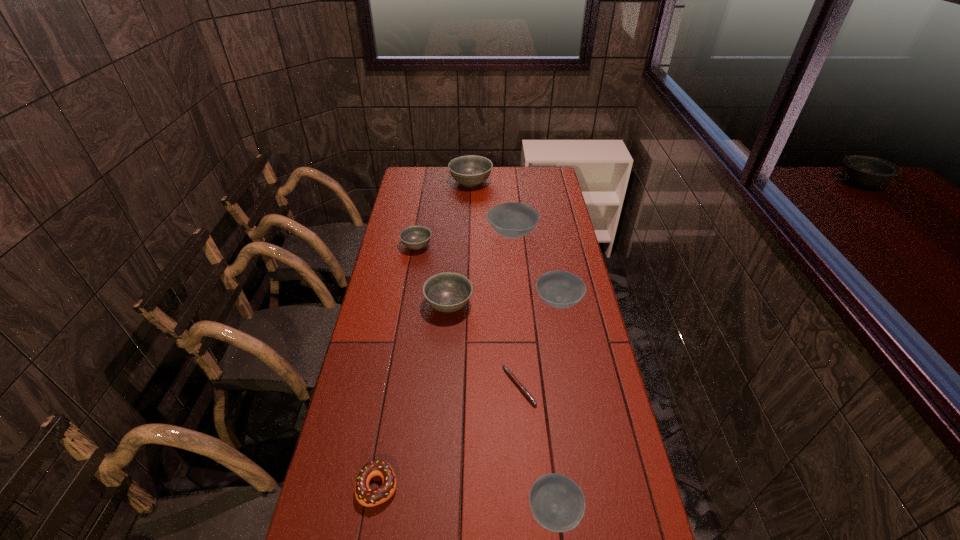
The width and height of the screenshot is (960, 540). I want to click on free spot that satisfies the following two spatial constraints: 1. on the front side of the smallest gray bowl; 2. on the left side of the doughnut, so click(375, 486).